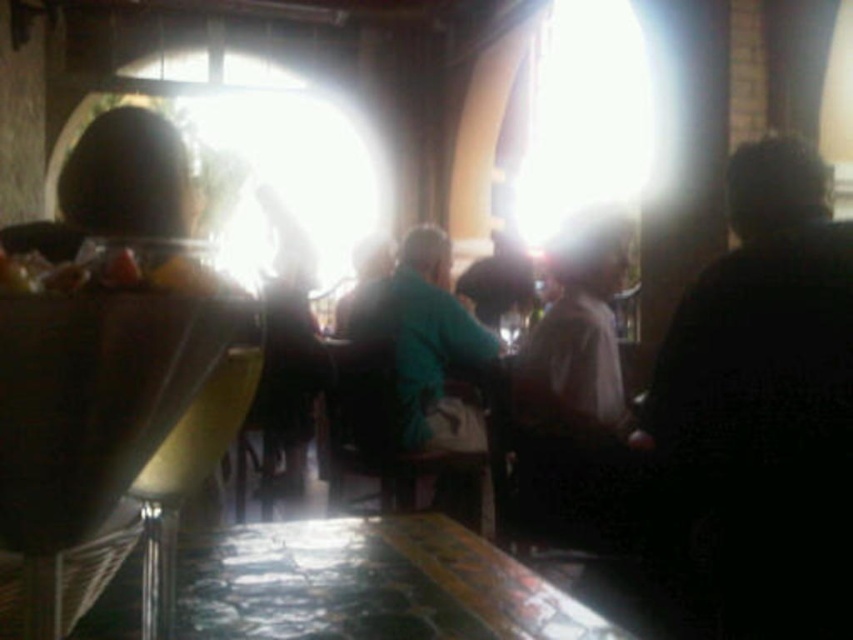
Question: Which of the following is the closest to the observer?

Choices:
 (A) yellow plastic cup at lower center
 (B) metallic reflective table at lower center
 (C) shiny plastic bag of chips at left
 (D) white fabric shirt at center

Answer: (C)

Question: Is yellow plastic cup at lower center bigger than shiny plastic bag of chips at left?

Choices:
 (A) yes
 (B) no

Answer: (A)

Question: Which point is farther from the camera taking this photo?

Choices:
 (A) (296, 608)
 (B) (612, 529)
 (C) (437, 248)
 (D) (21, 401)

Answer: (C)

Question: Is dark fabric shirt at right to the left of metallic reflective table at lower center from the viewer's perspective?

Choices:
 (A) yes
 (B) no

Answer: (B)

Question: Is clear plastic wine glass at left to the left of shiny plastic bag of chips at left from the viewer's perspective?

Choices:
 (A) yes
 (B) no

Answer: (A)

Question: Among these objects, which one is nearest to the camera?

Choices:
 (A) green matte shirt at center
 (B) dark fabric shirt at right

Answer: (B)